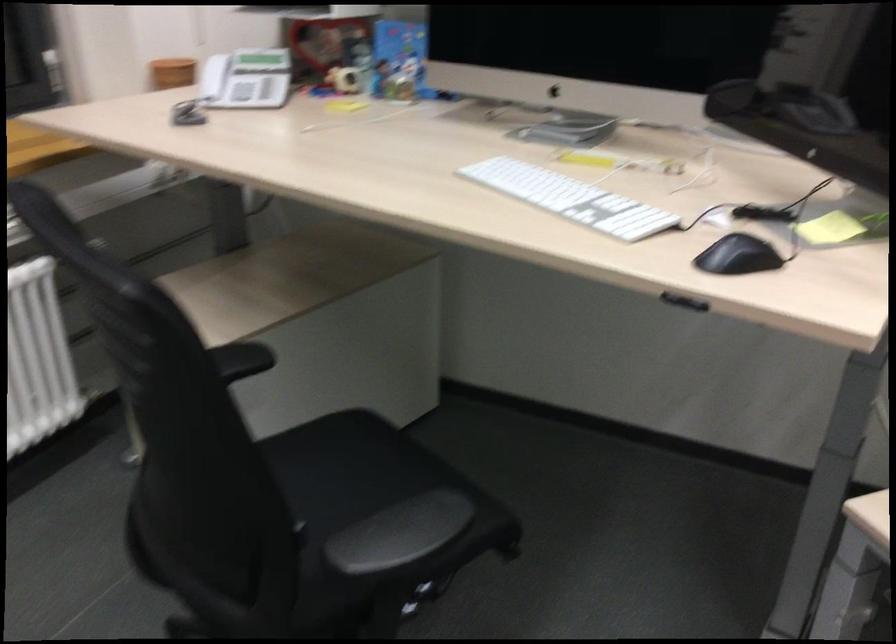
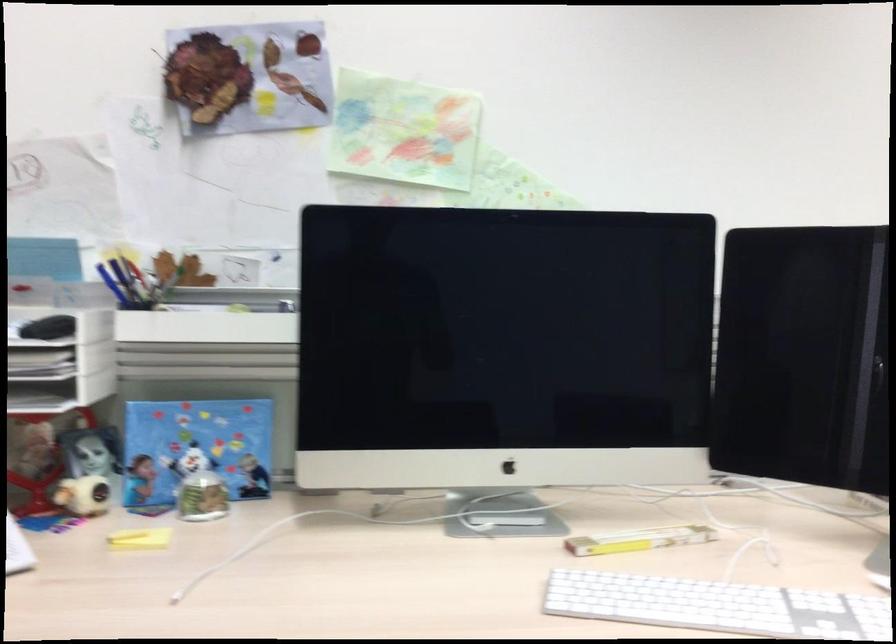
In the second image, find the point that corresponds to point (399, 90) in the first image.

(202, 497)